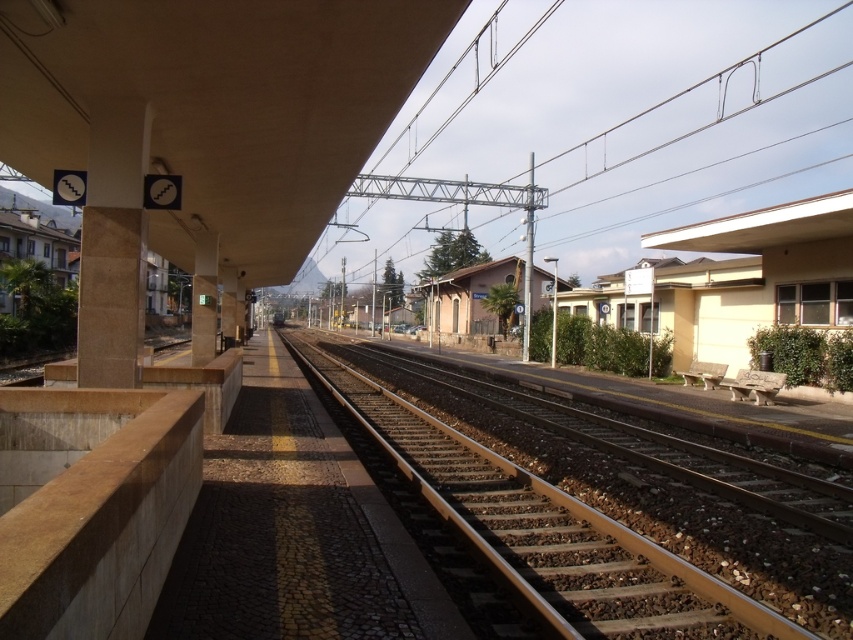
Question: Which point is farther to the camera?

Choices:
 (A) beige stone pillar at upper left
 (B) brown gravel track at center

Answer: (A)

Question: Does brown gravel track at center have a lesser width compared to beige stone pillar at upper left?

Choices:
 (A) yes
 (B) no

Answer: (B)

Question: Is brown gravel track at center to the left of beige stone pillar at upper left from the viewer's perspective?

Choices:
 (A) yes
 (B) no

Answer: (B)

Question: Is brown gravel track at center bigger than beige stone pillar at upper left?

Choices:
 (A) no
 (B) yes

Answer: (B)